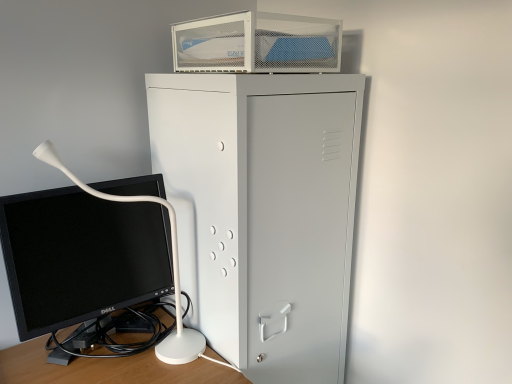
Question: From the image's perspective, is metallic gray cabinet at center beneath metal mesh container at upper center?

Choices:
 (A) yes
 (B) no

Answer: (A)

Question: From a real-world perspective, is metallic gray cabinet at center physically above metal mesh container at upper center?

Choices:
 (A) yes
 (B) no

Answer: (B)

Question: Is metallic gray cabinet at center positioned in front of metal mesh container at upper center?

Choices:
 (A) yes
 (B) no

Answer: (A)

Question: Can you confirm if metallic gray cabinet at center is positioned to the left of metal mesh container at upper center?

Choices:
 (A) no
 (B) yes

Answer: (A)

Question: Is metal mesh container at upper center inside metallic gray cabinet at center?

Choices:
 (A) no
 (B) yes

Answer: (A)

Question: Can you confirm if metallic gray cabinet at center is shorter than metal mesh container at upper center?

Choices:
 (A) no
 (B) yes

Answer: (A)

Question: Is black glossy computer monitor at lower left at the left side of metallic gray cabinet at center?

Choices:
 (A) no
 (B) yes

Answer: (B)

Question: Considering the relative sizes of black glossy computer monitor at lower left and metallic gray cabinet at center in the image provided, is black glossy computer monitor at lower left taller than metallic gray cabinet at center?

Choices:
 (A) no
 (B) yes

Answer: (A)

Question: Is black glossy computer monitor at lower left positioned behind metallic gray cabinet at center?

Choices:
 (A) yes
 (B) no

Answer: (B)

Question: Is black glossy computer monitor at lower left to the right of metallic gray cabinet at center from the viewer's perspective?

Choices:
 (A) no
 (B) yes

Answer: (A)

Question: From the image's perspective, does black glossy computer monitor at lower left appear lower than metallic gray cabinet at center?

Choices:
 (A) yes
 (B) no

Answer: (B)

Question: Does black glossy computer monitor at lower left have a greater width compared to metallic gray cabinet at center?

Choices:
 (A) no
 (B) yes

Answer: (A)

Question: Considering the relative sizes of metal mesh container at upper center and metallic gray cabinet at center in the image provided, is metal mesh container at upper center wider than metallic gray cabinet at center?

Choices:
 (A) no
 (B) yes

Answer: (A)